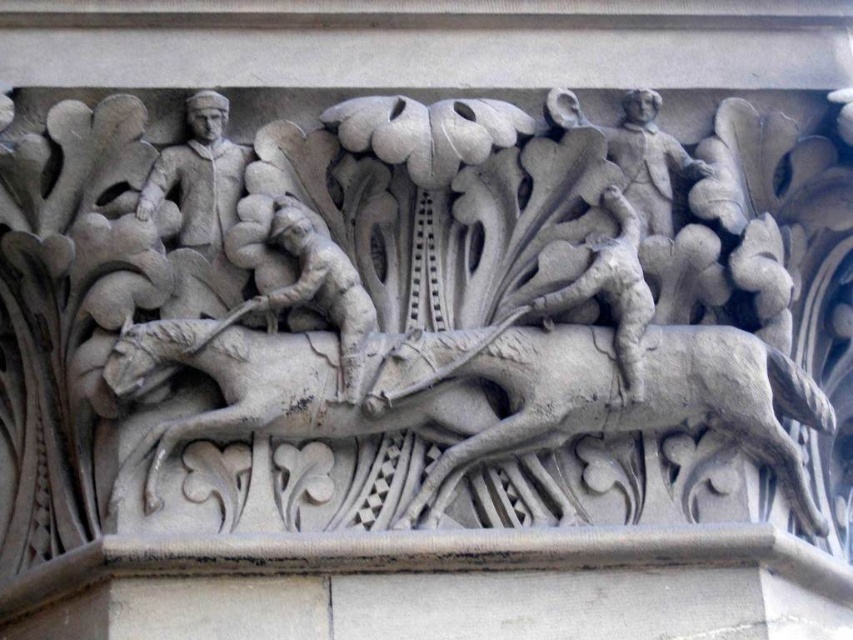
In the scene shown: You are an art conservator examining the stone relief sculpture. You notice the stone horse at center and the gray stone figure at center. Which object is positioned higher in the relief?

The stone horse at center is above the gray stone figure at center in the relief sculpture.